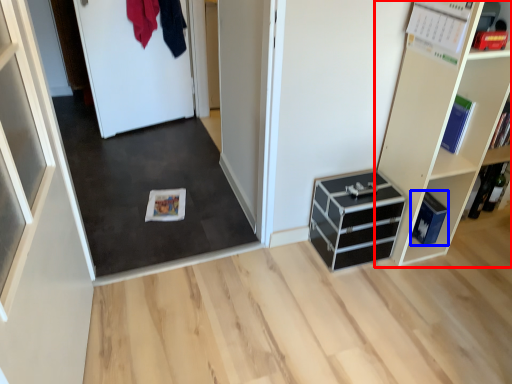
Question: Among these objects, which one is farthest to the camera, shelf (highlighted by a red box) or cabinetry (highlighted by a blue box)?

Choices:
 (A) shelf
 (B) cabinetry

Answer: (B)